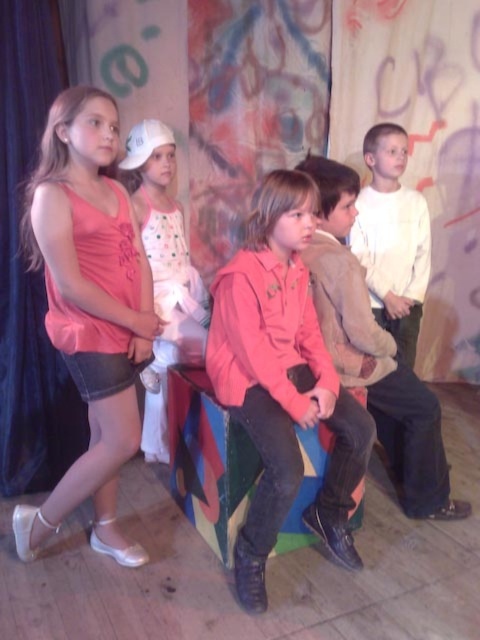
Question: Among these points, which one is farthest from the camera?

Choices:
 (A) (382, 186)
 (B) (248, 332)

Answer: (A)

Question: Does pink fleece jacket at center appear over white matte shirt at upper right?

Choices:
 (A) yes
 (B) no

Answer: (B)

Question: Can you confirm if pink fabric dress at left is positioned above pink fleece jacket at center?

Choices:
 (A) yes
 (B) no

Answer: (A)

Question: Which object appears closest to the camera in this image?

Choices:
 (A) pink fleece jacket at center
 (B) pink fabric dress at left

Answer: (A)

Question: Among these objects, which one is nearest to the camera?

Choices:
 (A) white matte shirt at upper right
 (B) pink fabric dress at left
 (C) pink fleece jacket at center

Answer: (C)

Question: Does pink fabric dress at left appear under pink fleece jacket at center?

Choices:
 (A) yes
 (B) no

Answer: (B)